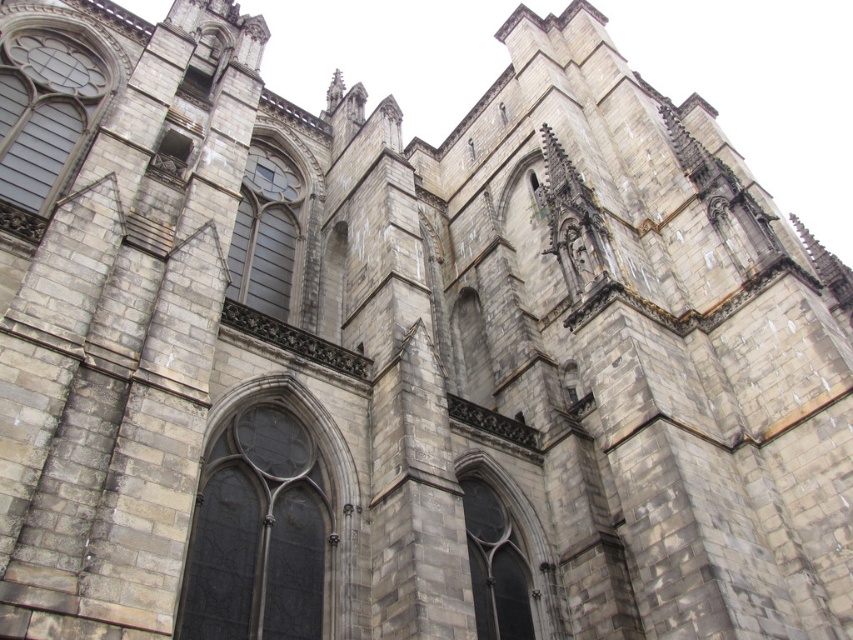
Question: Does gray stone window at center appear on the left side of dark gray stone window at center?

Choices:
 (A) no
 (B) yes

Answer: (B)

Question: Based on their relative distances, which object is farther from the dark gray stone window at center?

Choices:
 (A) dark gray stone window at upper left
 (B) dark glass window at center

Answer: (A)

Question: Considering the real-world distances, which object is farthest from the dark gray stone window at upper left?

Choices:
 (A) dark glass window at center
 (B) gray stone window at center
 (C) dark gray stone window at center

Answer: (C)

Question: Which object is closer to the camera taking this photo?

Choices:
 (A) dark gray stone window at upper left
 (B) gray stone window at center
 (C) dark gray stone window at center
 (D) dark glass window at center

Answer: (D)

Question: Does dark gray stone window at upper left come in front of gray stone window at center?

Choices:
 (A) yes
 (B) no

Answer: (B)

Question: Can you confirm if dark gray stone window at upper left is thinner than dark gray stone window at center?

Choices:
 (A) yes
 (B) no

Answer: (B)